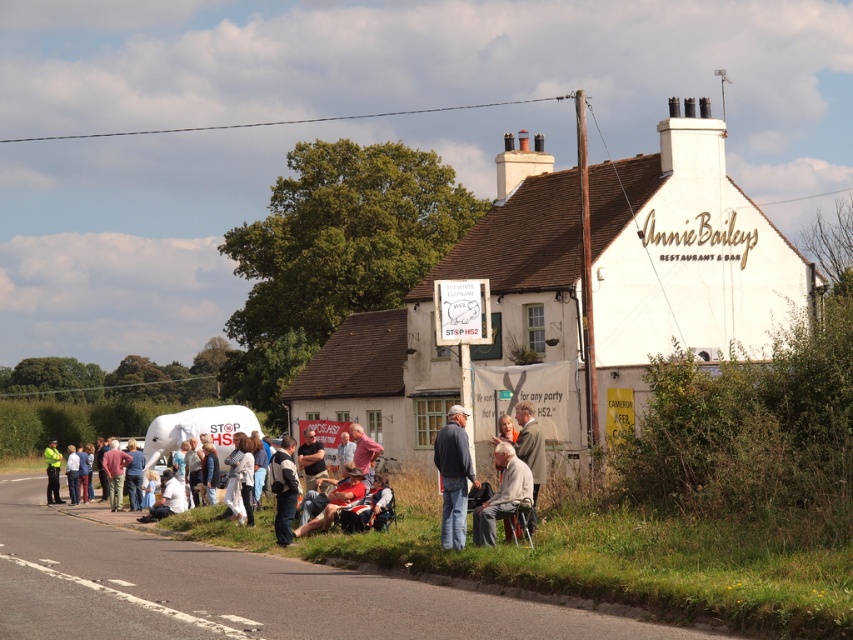
Based on the photo, you are a photographer standing at the back of the group. You want to take a photo of the light gray fabric jacket at center and the green uniformed person at lower left. Which one is closer to the camera?

The light gray fabric jacket at center is closer to the camera than the green uniformed person at lower left because it is not as tall as the green uniformed person at lower left, implying it is positioned in front.

You are a delivery person with a 5 meter long ladder that needs to be placed between the light beige fabric chair at lower center and the dark gray sweater at center. Can you fit the ladder horizontally between them without bending it?

The distance between the light beige fabric chair at lower center and the dark gray sweater at center is 4.84 meters. Since the ladder is 5 meters long, it is slightly too long to fit horizontally between them without bending.

You are a delivery person standing at the entrance of Annie Bailey Restaurant and Bar. You need to deliver a package to the dark gray sweater at center and the green uniformed person at lower left. Which recipient is closer to you?

The dark gray sweater at center is 24.73 meters away from the green uniformed person at lower left. Since you are at the entrance, it depends on their positions relative to the entrance. However, without specific distance from the entrance, we cannot determine who is closer.